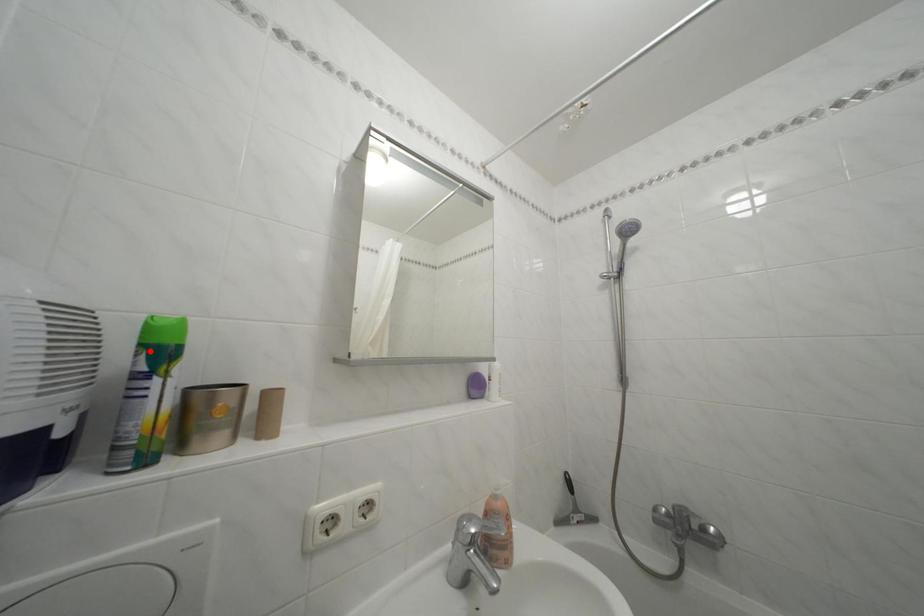
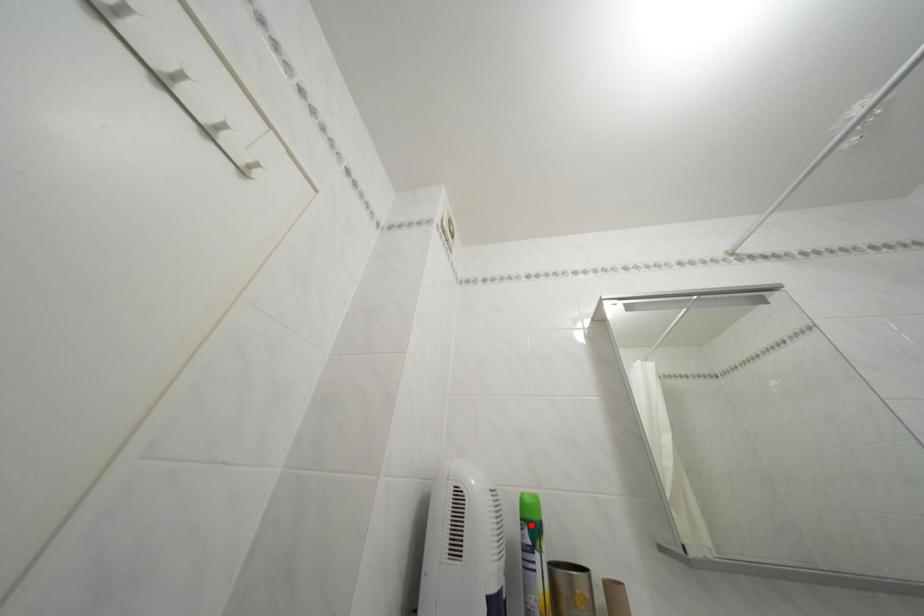
I am providing you with two images of the same scene from different viewpoints. A red point is marked on the first image and another point is marked on the second image. Do the highlighted points in image1 and image2 indicate the same real-world spot?

Yes